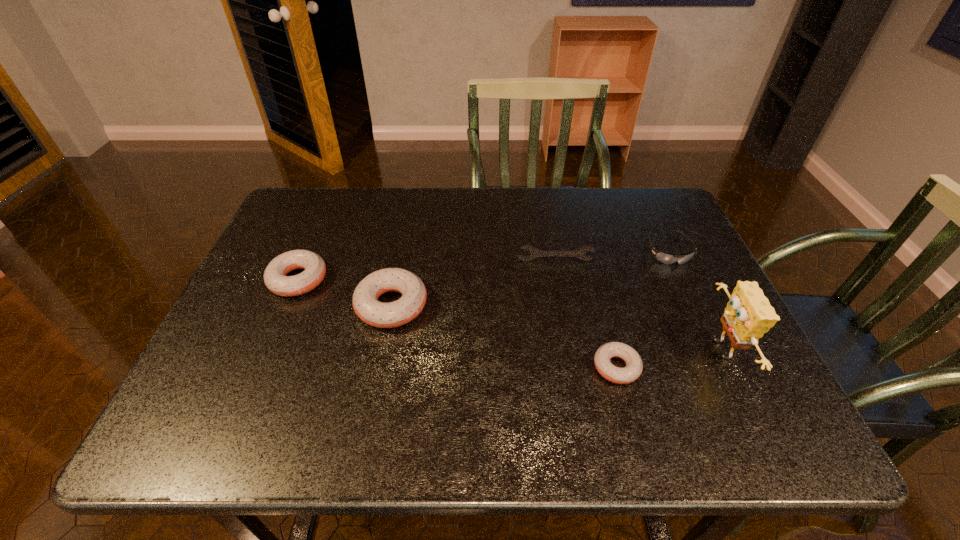
Where is `sponge that is positioned at the right edge`? The width and height of the screenshot is (960, 540). sponge that is positioned at the right edge is located at coordinates (748, 315).

Identify the location of object present at the near right corner. (748, 315).

This screenshot has height=540, width=960. Identify the location of vacant space at the far edge of the desktop. (613, 224).

Where is `free region at the near edge of the desktop`? The image size is (960, 540). free region at the near edge of the desktop is located at coordinates tap(661, 368).

I want to click on vacant space at the right edge of the desktop, so click(x=652, y=271).

This screenshot has width=960, height=540. In the image, there is a desktop. Find the location of `blank space at the far left corner`. blank space at the far left corner is located at coordinates (337, 201).

This screenshot has height=540, width=960. In order to click on vacant space at the far right corner of the desktop in this screenshot , I will do `click(661, 206)`.

Locate an element on the screen. The height and width of the screenshot is (540, 960). free location at the near right corner is located at coordinates (x=733, y=394).

Where is `blank region between the wrench and the fifth object from right to left`? The height and width of the screenshot is (540, 960). blank region between the wrench and the fifth object from right to left is located at coordinates (473, 283).

Locate an element on the screen. blank region between the tallest object and the sunglasses is located at coordinates (694, 301).